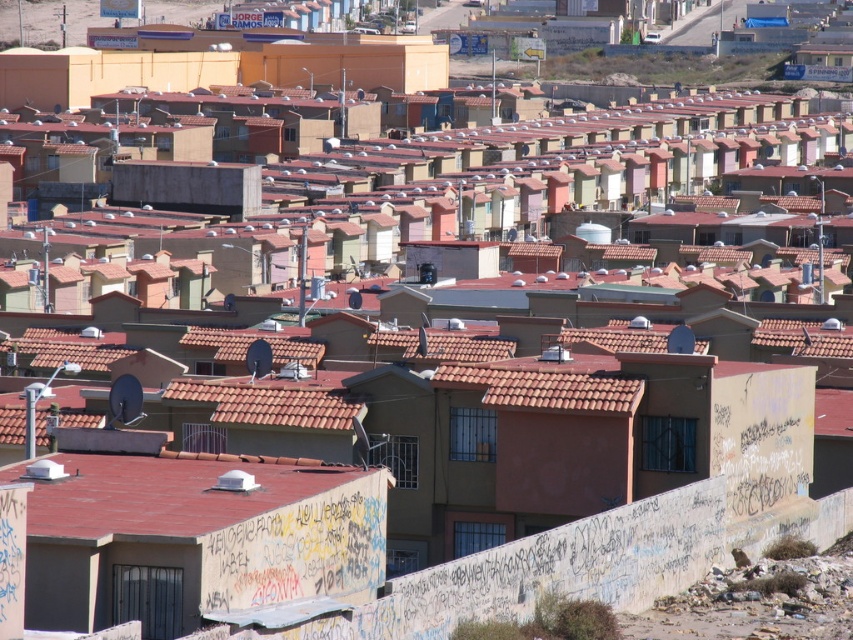
Consider the image. You are standing at the center of the image and want to locate the red tile roof at lower left. Which direction should you look to find it?

The red tile roof at lower left is located at point (167, 493), so you should look to the lower left direction to find it.